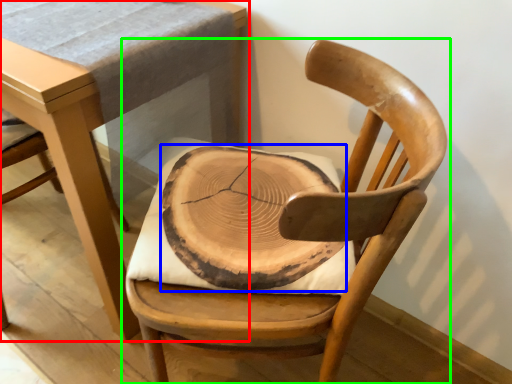
Question: Estimate the real-world distances between objects in this image. Which object is closer to table (highlighted by a red box), pad (highlighted by a blue box) or chair (highlighted by a green box)?

Choices:
 (A) pad
 (B) chair

Answer: (A)